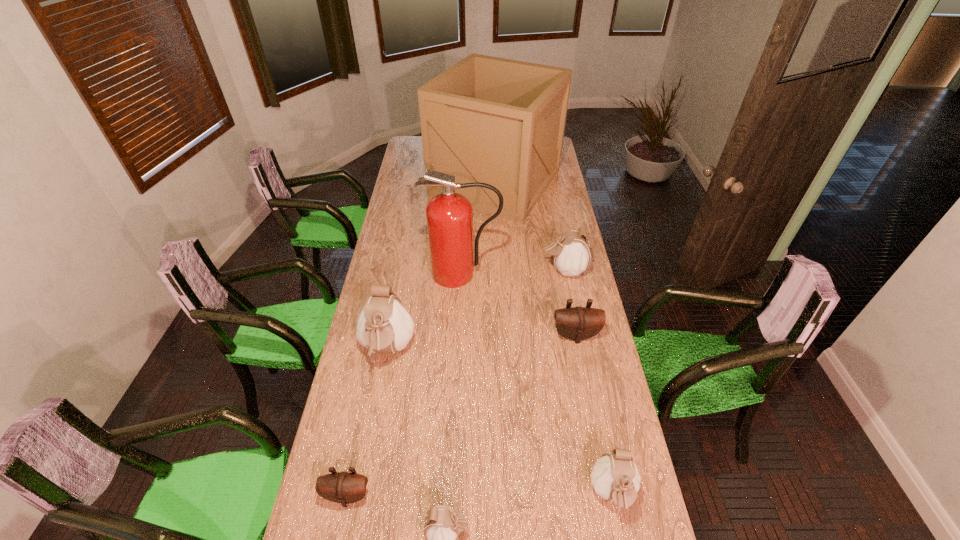
Identify the location of empty space between the third biggest white pouch and the smaller brown pouch. The image size is (960, 540). coord(480,495).

Where is `unoccupied area between the farther brown pouch and the fire extinguisher`? The width and height of the screenshot is (960, 540). unoccupied area between the farther brown pouch and the fire extinguisher is located at coordinates (519, 304).

This screenshot has height=540, width=960. In order to click on vacant region between the fifth shortest object and the left brown pouch in this screenshot , I will do `click(456, 383)`.

Identify the location of the fifth closest object to the nearer brown pouch. The image size is (960, 540). (449, 215).

Identify the location of object that is the closest to the left brown pouch. (442, 525).

Identify which pouch is the fourth closest to the third biggest white pouch. Please provide its 2D coordinates. Your answer should be formatted as a tuple, i.e. [(x, y)], where the tuple contains the x and y coordinates of a point satisfying the conditions above.

[(384, 325)]

At what (x,y) coordinates should I click in order to perform the action: click on pouch that stands as the third closest to the third tallest object. Please return your answer as a coordinate pair (x, y). Looking at the image, I should click on (578, 323).

Select which white pouch appears as the second closest to the second smallest white pouch. Please provide its 2D coordinates. Your answer should be formatted as a tuple, i.e. [(x, y)], where the tuple contains the x and y coordinates of a point satisfying the conditions above.

[(384, 325)]

Locate which white pouch ranks third in proximity to the third white pouch from right to left. Please provide its 2D coordinates. Your answer should be formatted as a tuple, i.e. [(x, y)], where the tuple contains the x and y coordinates of a point satisfying the conditions above.

[(571, 253)]